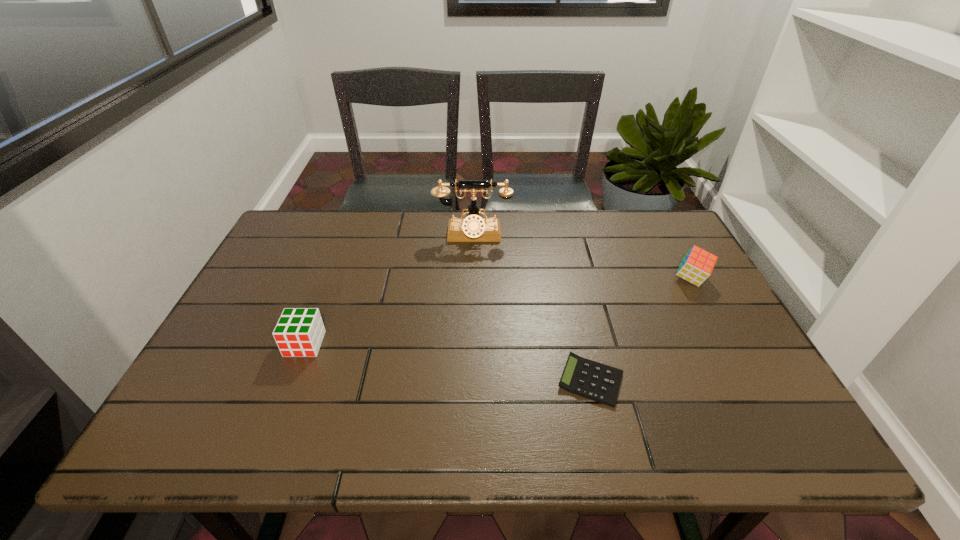
Identify the location of vacant point located on the red face of the leftmost object. (275, 422).

You are a GUI agent. You are given a task and a screenshot of the screen. Output one action in this format:
    pyautogui.click(x=<x>, y=<y>)
    Task: Click on the free space located on the back of the third object from left to right
    The width and height of the screenshot is (960, 540).
    Given the screenshot: What is the action you would take?
    pyautogui.click(x=572, y=300)

At what (x,y) coordinates should I click in order to perform the action: click on object at the far edge. Please return your answer as a coordinate pair (x, y). The height and width of the screenshot is (540, 960). Looking at the image, I should click on (473, 228).

Locate an element on the screen. object at the right edge is located at coordinates (697, 265).

In the image, there is a desktop. Identify the location of vacant area at the far edge. (511, 251).

Where is `free space at the near edge`? The width and height of the screenshot is (960, 540). free space at the near edge is located at coordinates (380, 438).

This screenshot has height=540, width=960. In the image, there is a desktop. In order to click on vacant space at the left edge in this screenshot , I will do `click(301, 289)`.

Where is `vacant space at the right edge`? The width and height of the screenshot is (960, 540). vacant space at the right edge is located at coordinates (660, 276).

Image resolution: width=960 pixels, height=540 pixels. I want to click on free space at the far right corner, so click(652, 221).

Image resolution: width=960 pixels, height=540 pixels. Identify the location of unoccupied position between the second farthest object and the third object from left to right. (x=641, y=330).